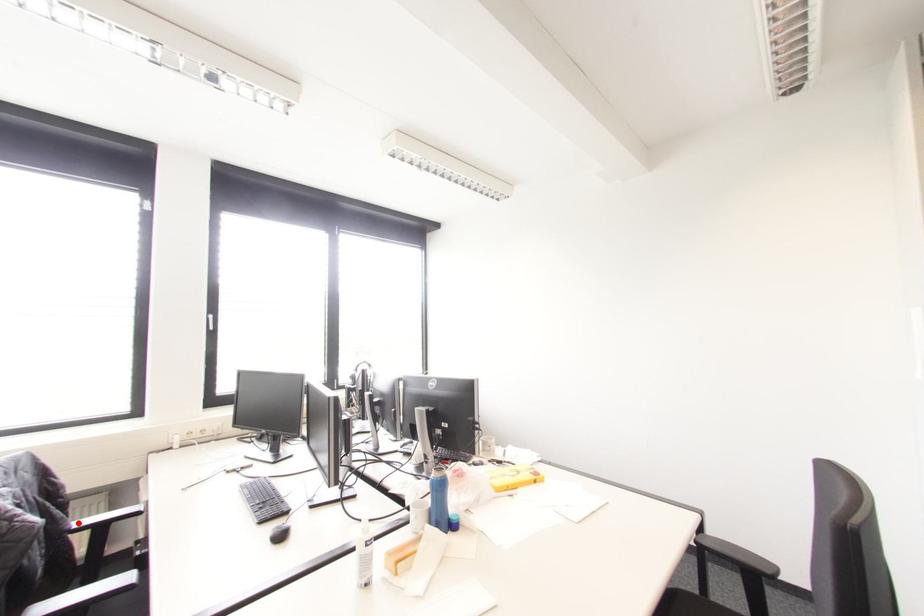
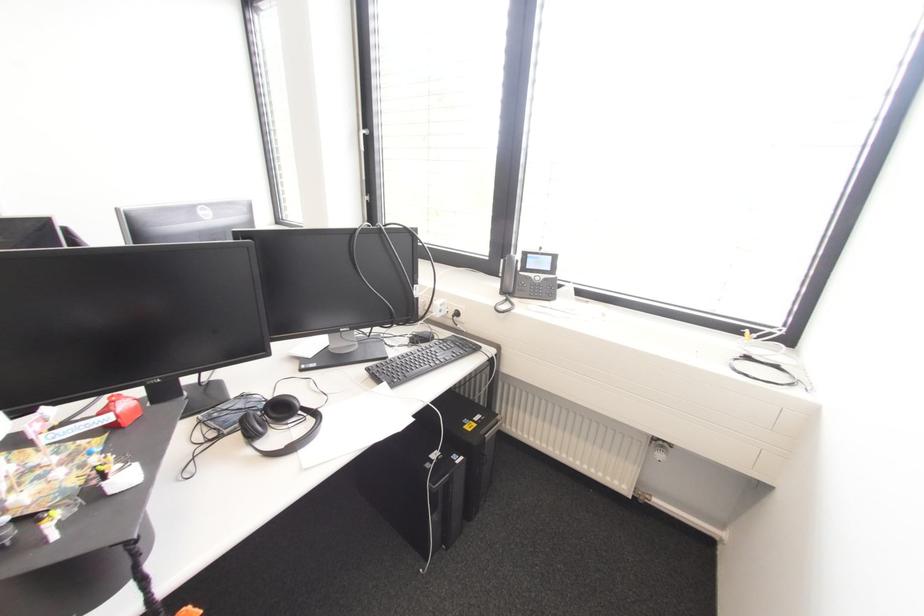
Question: I am providing you with two images of the same scene from different viewpoints. A red point is marked on the first image. At the location where the point appears in image 1, is it still visible in image 2?

Choices:
 (A) Yes
 (B) No

Answer: (B)